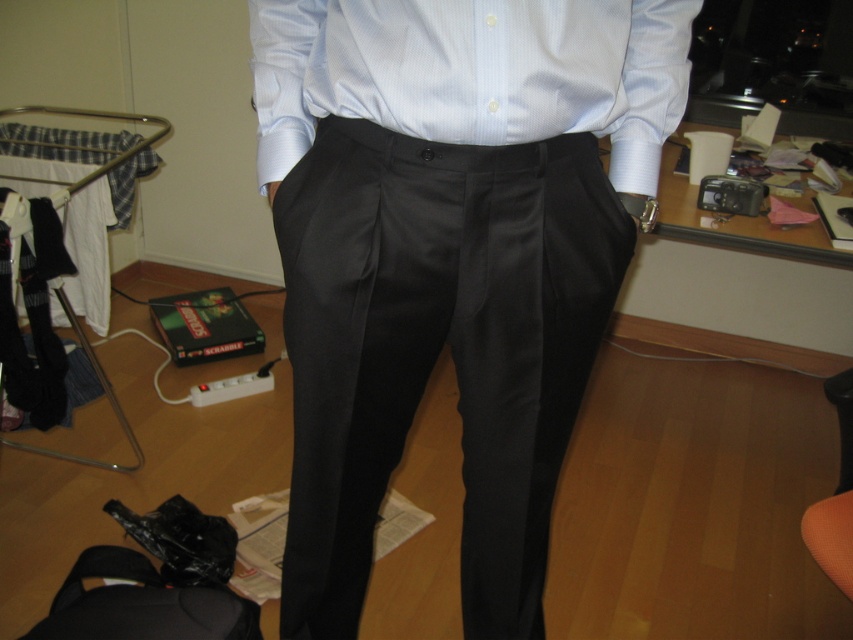
You are organizing a closet and need to place the satin black trousers at center and the satin smooth shirt at center on a shelf. Given that the shelf can only hold items up to the width of the shirt, will both items fit side by side?

The satin black trousers at center is wider than the satin smooth shirt at center. Since the shelf can only hold items up to the shirt width, the trousers will not fit side by side with the shirt on the shelf.

You are standing in the room and want to pick up an item. There are two points marked in the scene, point 1 at coordinates (282,186) and point 2 at coordinates (296,132). Which point is closer to you?

Point 1 at coordinates (282,186) is closer to the viewer than point 2 at coordinates (296,132).